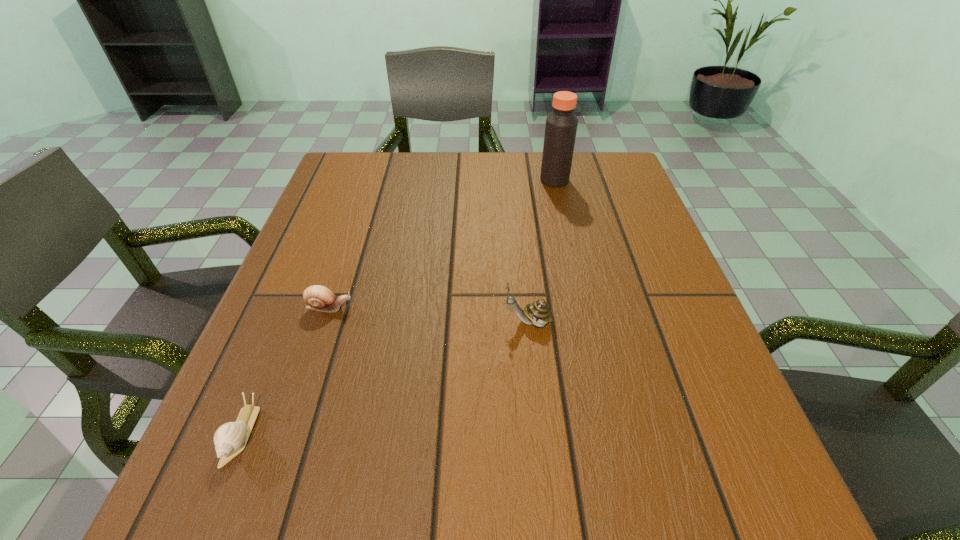
The height and width of the screenshot is (540, 960). I want to click on the rightmost object, so click(x=561, y=125).

I want to click on the farthest object, so click(561, 125).

Where is `the tallest escargot`? The width and height of the screenshot is (960, 540). the tallest escargot is located at coordinates (537, 313).

Where is `the third object from left to right`? the third object from left to right is located at coordinates (537, 313).

Find the location of a particular element. Image resolution: width=960 pixels, height=540 pixels. the third object from right to left is located at coordinates (319, 298).

Find the location of a particular element. The image size is (960, 540). the second tallest escargot is located at coordinates (319, 298).

At what (x,y) coordinates should I click in order to perform the action: click on the shortest escargot. Please return your answer as a coordinate pair (x, y). Looking at the image, I should click on (230, 439).

Locate an element on the screen. The height and width of the screenshot is (540, 960). the nearest escargot is located at coordinates (230, 439).

This screenshot has height=540, width=960. Find the location of `blank space located on the right of the farthest object`. blank space located on the right of the farthest object is located at coordinates (627, 180).

You are a GUI agent. You are given a task and a screenshot of the screen. Output one action in this format:
    pyautogui.click(x=<x>, y=<y>)
    Task: Click on the vacant area located on the face of the tallest escargot
    The image size is (960, 540).
    Given the screenshot: What is the action you would take?
    pyautogui.click(x=365, y=322)